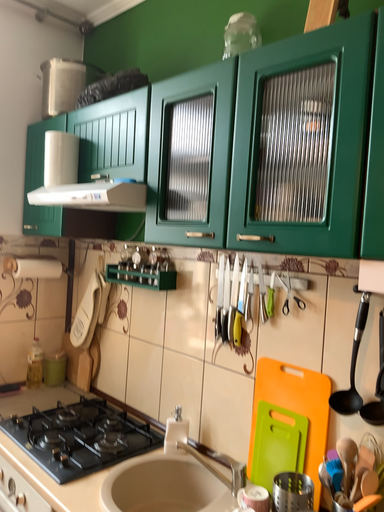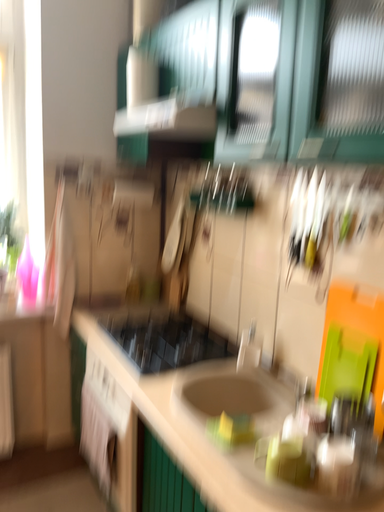
Question: Which way did the camera rotate in the video?

Choices:
 (A) rotated downward
 (B) rotated upward

Answer: (A)